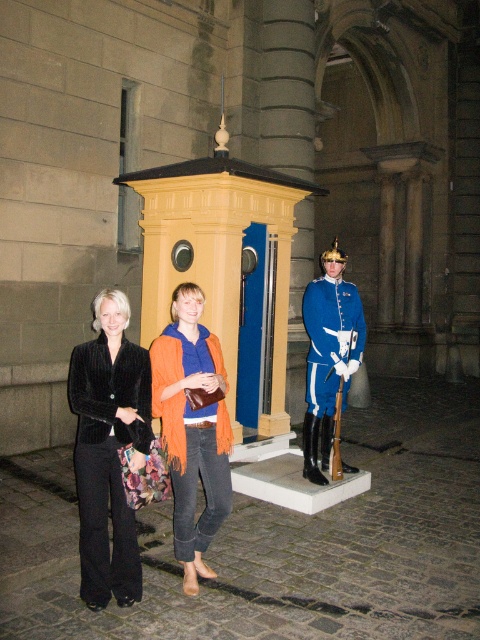
Who is positioned more to the left, velvet black uniform at center or blue glossy uniform at center?

Positioned to the left is velvet black uniform at center.

Between velvet black uniform at center and blue glossy uniform at center, which one has more height?

blue glossy uniform at center is taller.

Is point (91, 493) closer to viewer compared to point (326, 275)?

Yes, point (91, 493) is in front of point (326, 275).

Find the location of a particular element. velvet black uniform at center is located at coordinates (108, 464).

Is velvet black uniform at center positioned in front of orange knitted scarf at center?

Yes, velvet black uniform at center is in front of orange knitted scarf at center.

Does point (147, 385) come behind point (203, 362)?

That is False.

The image size is (480, 640). I want to click on velvet black uniform at center, so click(x=108, y=464).

Is point (180, 426) farther from viewer compared to point (302, 451)?

No.

Where is `orange knitted scarf at center`? orange knitted scarf at center is located at coordinates (192, 428).

The image size is (480, 640). Identify the location of orange knitted scarf at center. (192, 428).